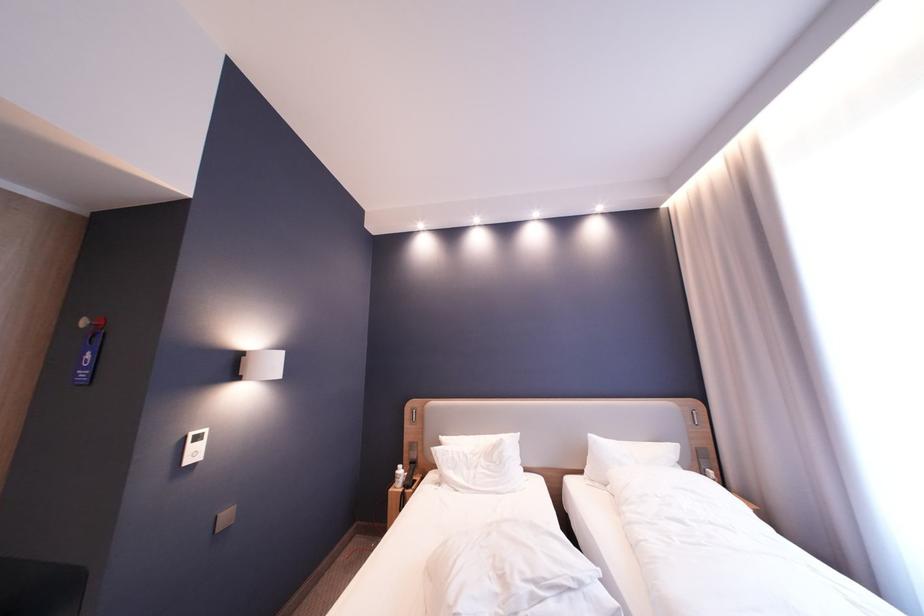
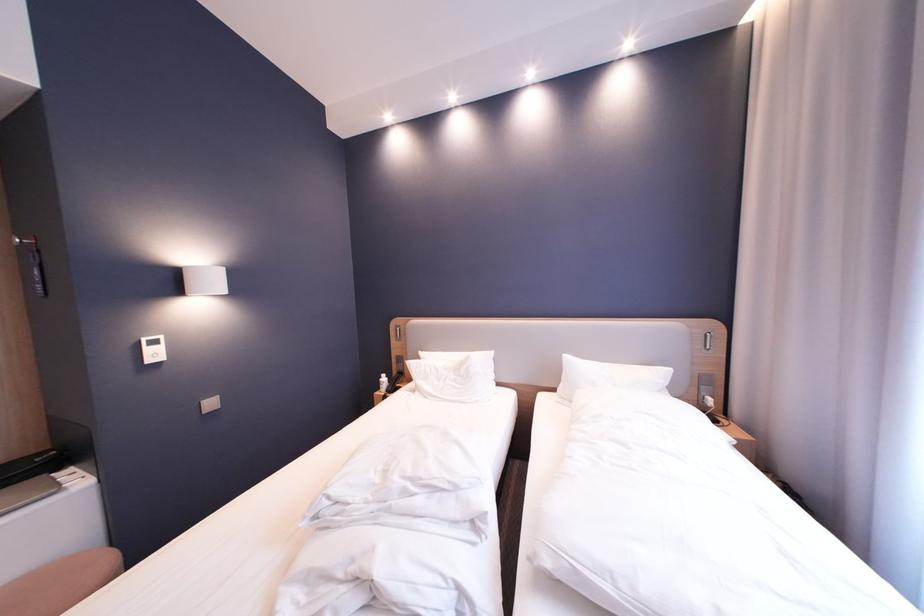
Find the pixel in the second image that matches (480,469) in the first image.

(450, 382)